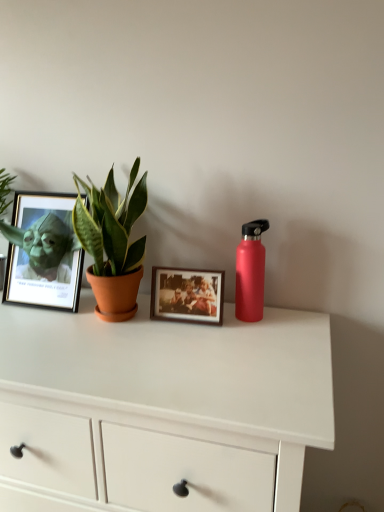
Where is `free point below green matte plant at left (from a real-world perspective)`? The height and width of the screenshot is (512, 384). free point below green matte plant at left (from a real-world perspective) is located at coordinates (117, 320).